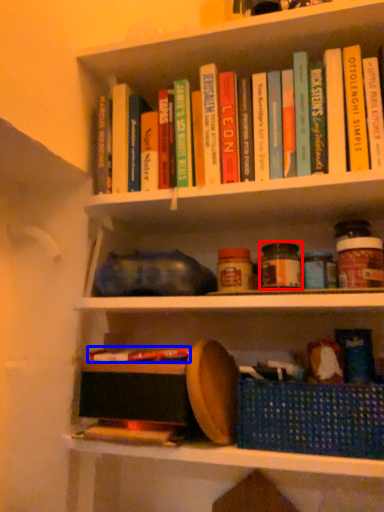
Question: Which object is further to the camera taking this photo, glass jar (highlighted by a red box) or book (highlighted by a blue box)?

Choices:
 (A) glass jar
 (B) book

Answer: (A)